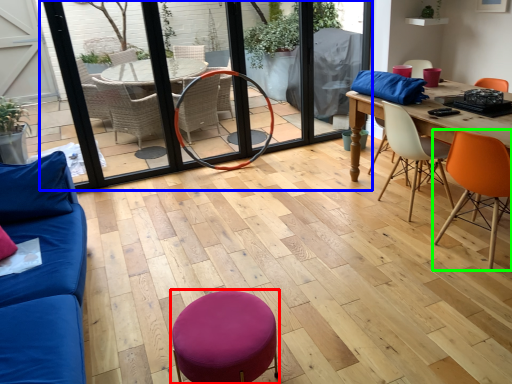
Question: Based on their relative distances, which object is farther from bar stool (highlighted by a red box)? Choose from screen door (highlighted by a blue box) and chair (highlighted by a green box).

Choices:
 (A) screen door
 (B) chair

Answer: (A)